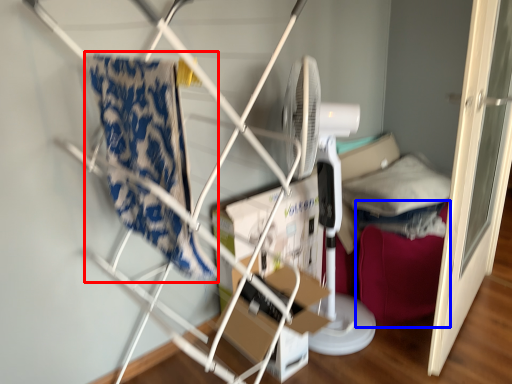
Question: Which object appears farthest to the camera in this image, beach towel (highlighted by a red box) or bean bag chair (highlighted by a blue box)?

Choices:
 (A) beach towel
 (B) bean bag chair

Answer: (B)